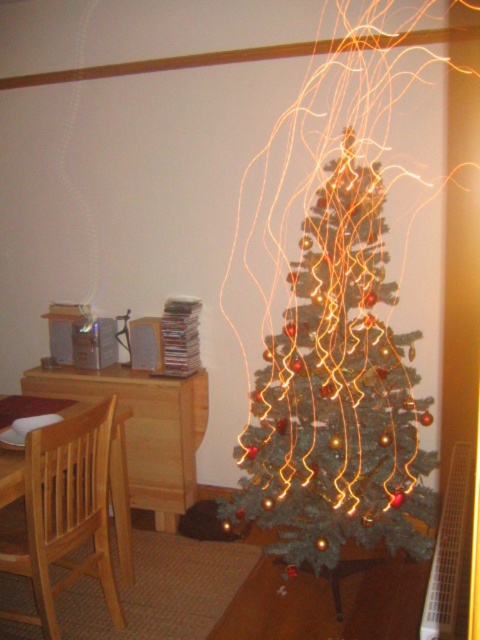
You are a guest in this room and want to sit down on the light brown wooden chair at left. To reach it, you need to walk around the green matte christmas tree at center. Which direction should you walk around the tree to approach the chair?

The green matte christmas tree at center is to the right of the light brown wooden chair at left. To reach the chair, you should walk around the tree to the left side, moving counter clockwise, so you can approach the chair from its left side.

You are a delivery person who just arrived with a large package that requires a space of at least 3 feet to place it. You see the light brown wooden chair at left and the light wood table at left in the room. Can you place the package between them?

The distance between the light brown wooden chair at left and the light wood table at left is 30.68 inches, which is approximately 2.56 feet. Since the required space is at least 3 feet, the package cannot be placed between them.